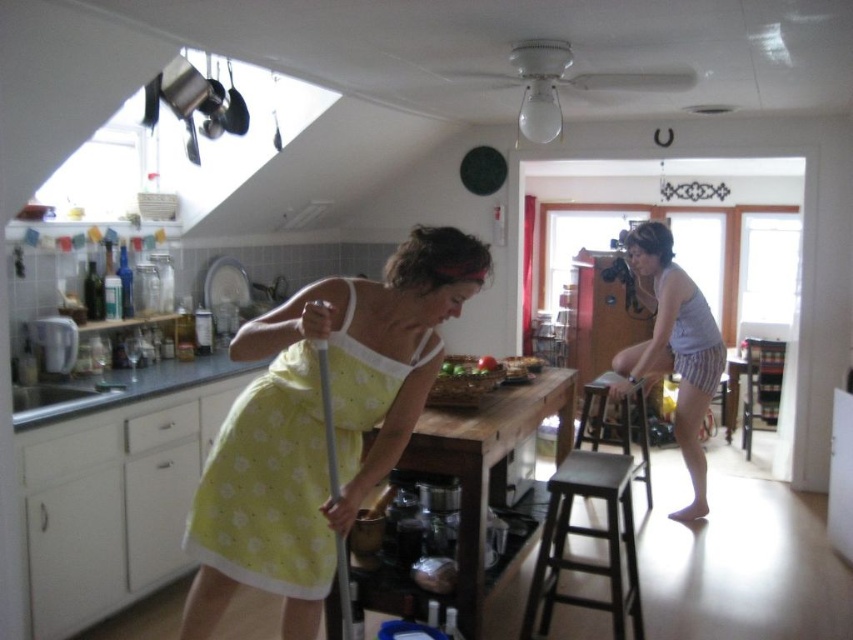
Question: Is yellow dotted fabric dress at lower left below wooden stool at center?

Choices:
 (A) yes
 (B) no

Answer: (B)

Question: Among these objects, which one is nearest to the camera?

Choices:
 (A) wooden stool at center
 (B) yellow dotted fabric dress at lower left
 (C) gray cotton tank top at center
 (D) gray striped apron at right

Answer: (B)

Question: Does dark brown wooden stool at lower center have a greater width compared to gray striped apron at right?

Choices:
 (A) no
 (B) yes

Answer: (B)

Question: Is yellow dotted fabric dress at lower left wider than gray cotton tank top at center?

Choices:
 (A) no
 (B) yes

Answer: (B)

Question: Estimate the real-world distances between objects in this image. Which object is farther from the wooden stool at center?

Choices:
 (A) gray striped apron at right
 (B) dark brown wooden stool at lower center
 (C) yellow dotted fabric dress at lower left

Answer: (C)

Question: Which object is the farthest from the wooden stool at center?

Choices:
 (A) gray striped apron at right
 (B) dark brown wooden stool at lower center
 (C) yellow dotted fabric dress at lower left
 (D) gray cotton tank top at center

Answer: (C)